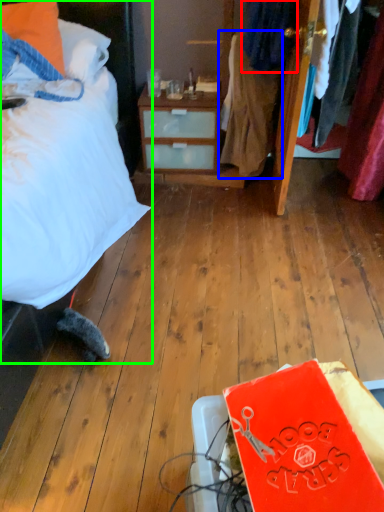
Question: Which object is the closest to the clothing (highlighted by a red box)? Choose among these: clothing (highlighted by a blue box) or bed (highlighted by a green box).

Choices:
 (A) clothing
 (B) bed

Answer: (A)